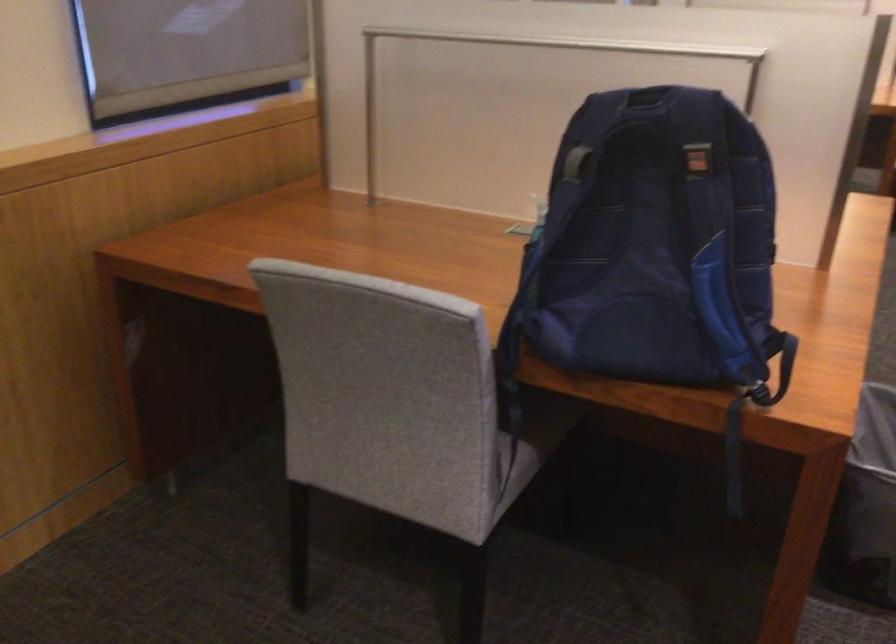
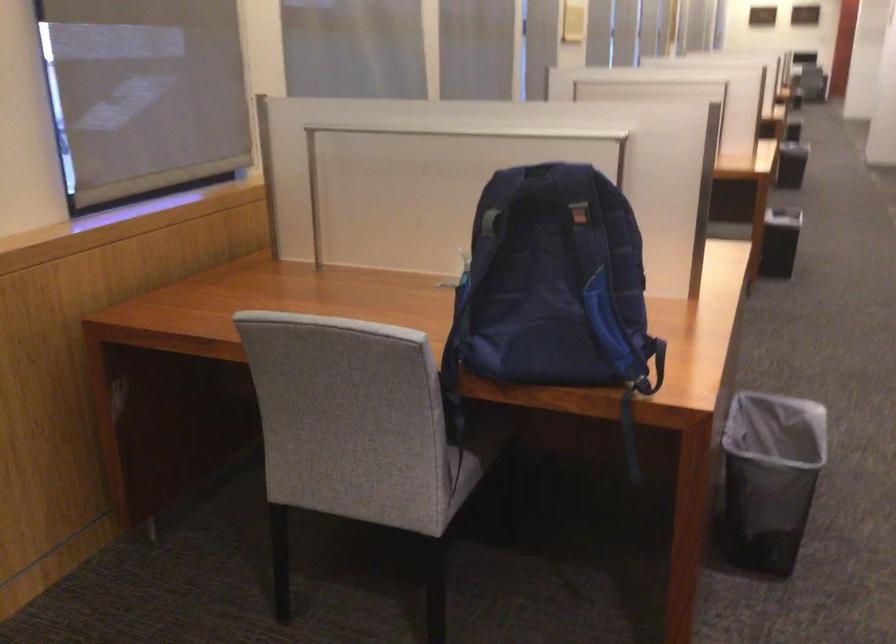
Locate, in the second image, the point that corresponds to [643,120] in the first image.

(538, 184)